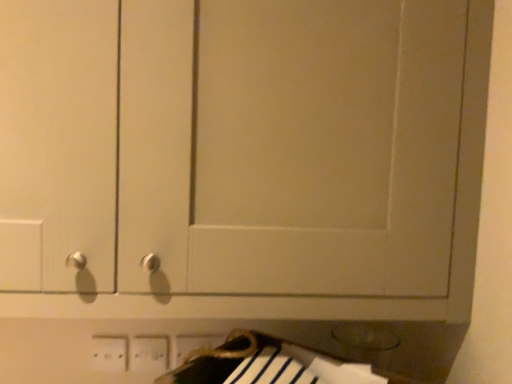
Question: Is white plastic electric outlet at lower center, which is counted as the 1th electric outlet, starting from the left, wider or thinner than white plastic electric outlet at lower center, acting as the 2th electric outlet starting from the left?

Choices:
 (A) thin
 (B) wide

Answer: (A)

Question: Does point (116, 362) appear closer or farther from the camera than point (157, 367)?

Choices:
 (A) closer
 (B) farther

Answer: (B)

Question: Based on their relative distances, which object is farther from the white plastic electric outlet at lower center, acting as the 2th electric outlet starting from the right?

Choices:
 (A) white plastic electric outlet at lower center, arranged as the 3th electric outlet when viewed from the right
 (B) white plastic electric outlet at lower center, which ranks as the 3th electric outlet in left-to-right order

Answer: (B)

Question: Which is farther from the white plastic electric outlet at lower center, which is counted as the 1th electric outlet, starting from the left?

Choices:
 (A) white plastic electric outlet at lower center, which appears as the first electric outlet when viewed from the right
 (B) white plastic electric outlet at lower center, acting as the 2th electric outlet starting from the left

Answer: (A)